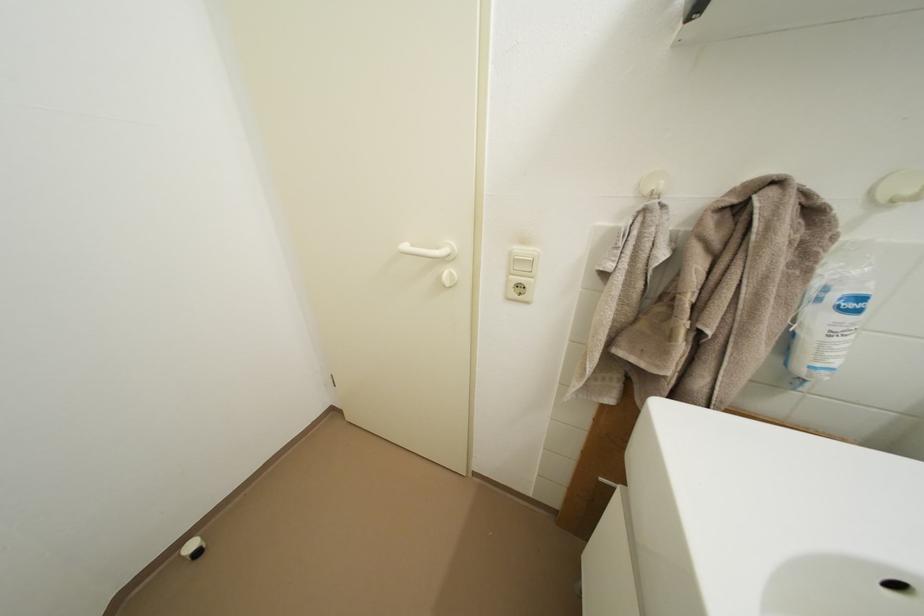
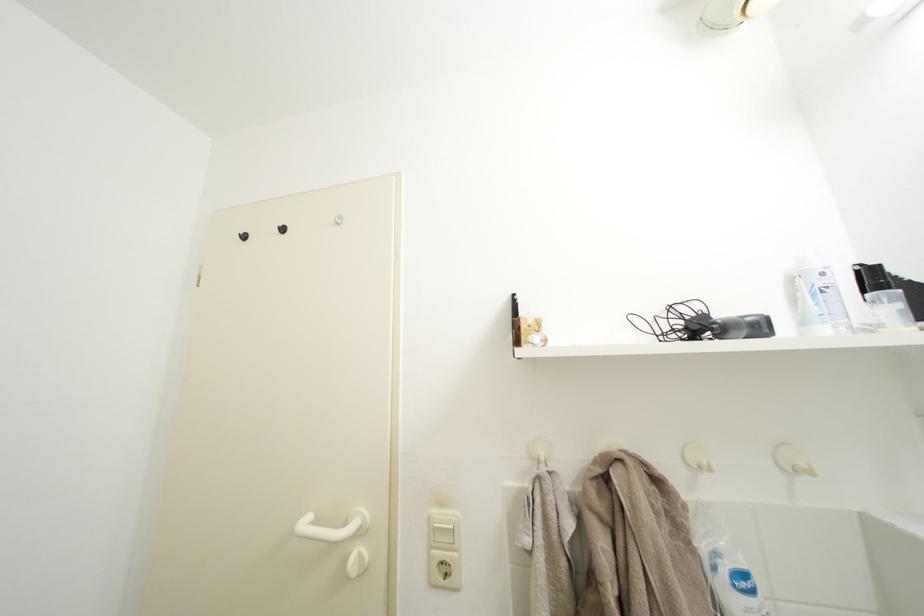
Locate, in the second image, the point that corresponds to [880,198] in the first image.

(694, 464)